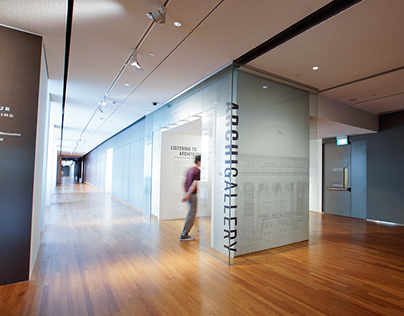
Where is `ceiling`? The height and width of the screenshot is (316, 404). ceiling is located at coordinates (107, 40).